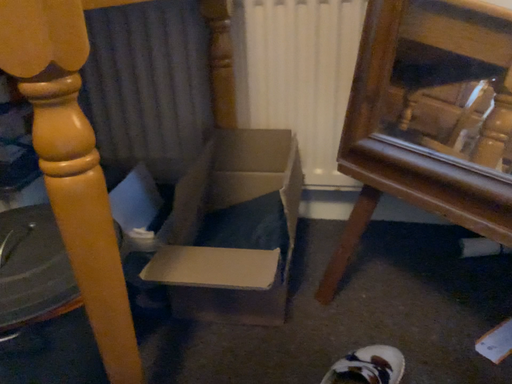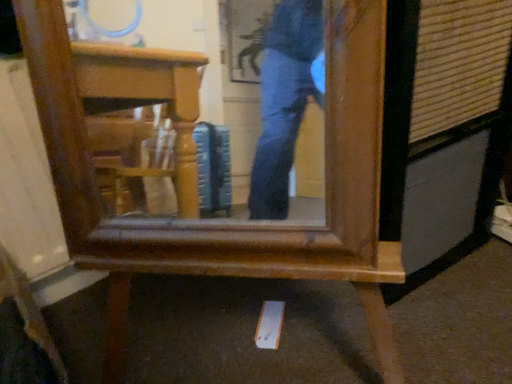
Question: How did the camera likely rotate when shooting the video?

Choices:
 (A) rotated left
 (B) rotated right

Answer: (B)